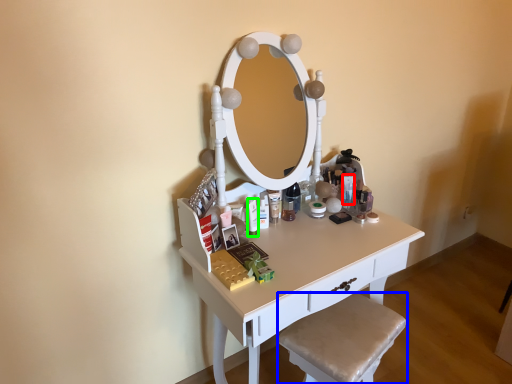
Question: Estimate the real-world distances between objects in this image. Which object is closer to toiletry (highlighted by a red box), step stool (highlighted by a blue box) or toiletry (highlighted by a green box)?

Choices:
 (A) step stool
 (B) toiletry

Answer: (B)